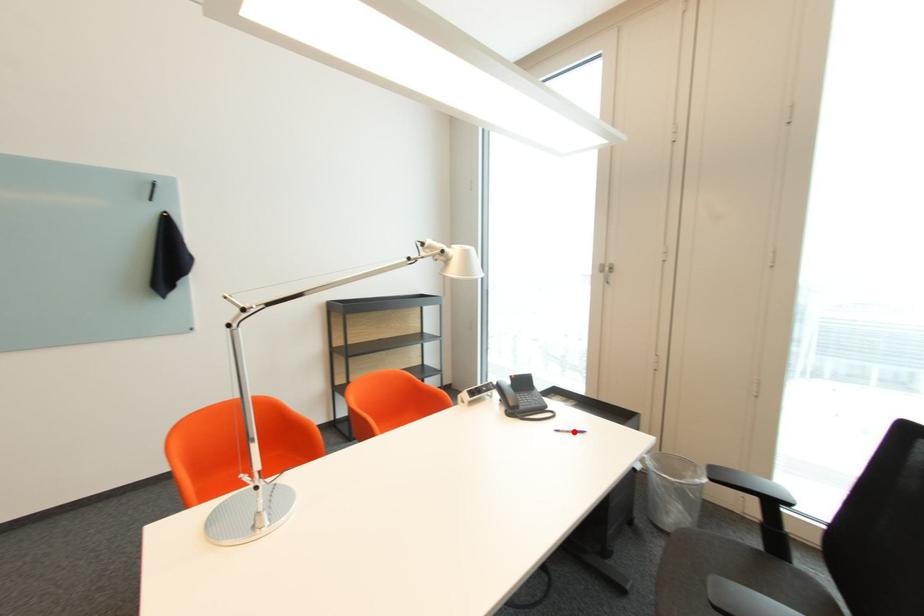
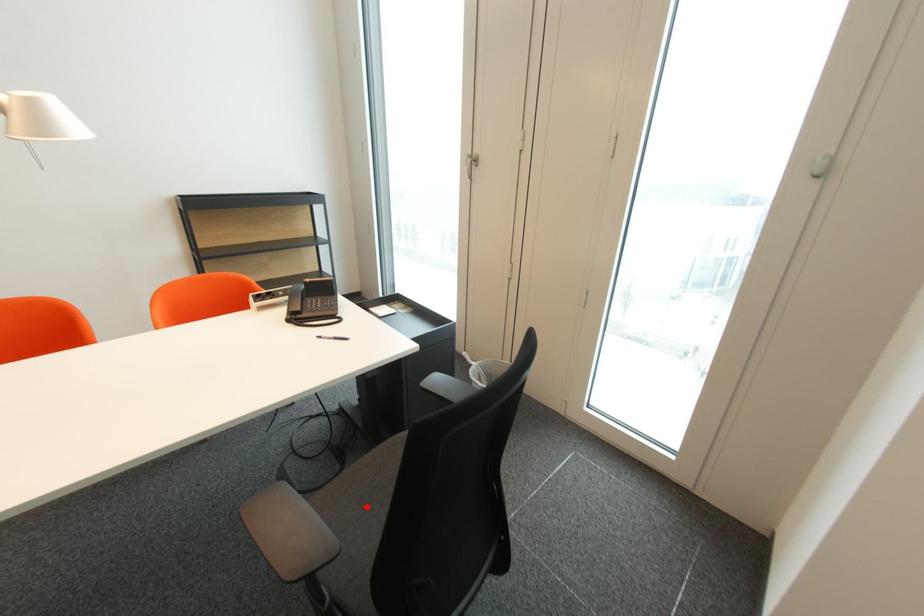
I am providing you with two images of the same scene from different viewpoints. A red point is marked on the first image and another point is marked on the second image. Do the highlighted points in image1 and image2 indicate the same real-world spot?

No